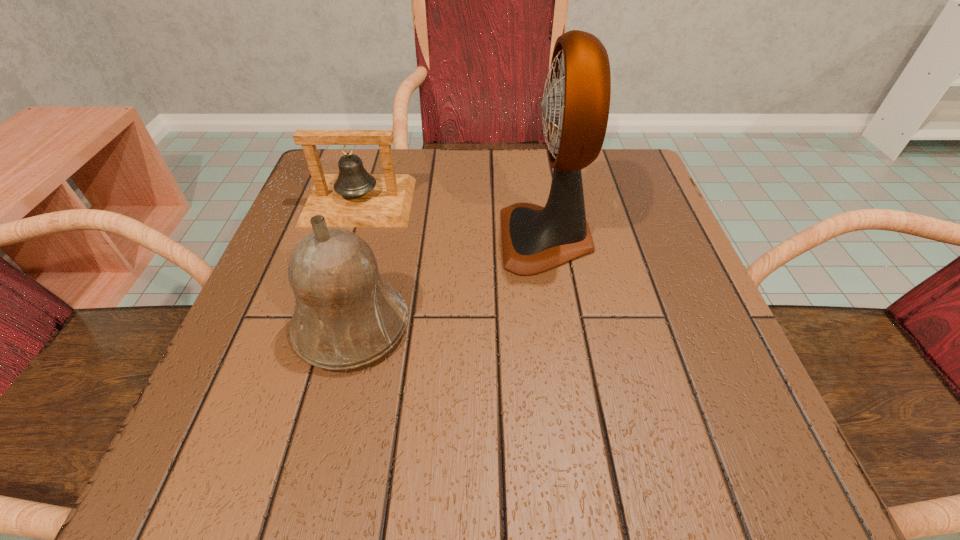
The width and height of the screenshot is (960, 540). I want to click on vacant space located on the right of the farther bell, so click(x=465, y=202).

Locate an element on the screen. This screenshot has width=960, height=540. fan located in the far edge section of the desktop is located at coordinates (575, 107).

At what (x,y) coordinates should I click in order to perform the action: click on bell located in the far edge section of the desktop. Please return your answer as a coordinate pair (x, y). This screenshot has width=960, height=540. Looking at the image, I should click on (353, 198).

Where is `object that is at the right edge`? object that is at the right edge is located at coordinates click(x=575, y=107).

The image size is (960, 540). Find the location of `object located in the far left corner section of the desktop`. object located in the far left corner section of the desktop is located at coordinates click(353, 198).

Find the location of a particular element. This screenshot has height=540, width=960. object that is at the far right corner is located at coordinates (575, 107).

You are a GUI agent. You are given a task and a screenshot of the screen. Output one action in this format:
    pyautogui.click(x=<x>, y=<y>)
    Task: Click on the free location at the far edge
    The image size is (960, 540).
    Given the screenshot: What is the action you would take?
    pyautogui.click(x=417, y=151)

What are the coordinates of `vacant space at the near edge of the desktop` in the screenshot? It's located at (442, 460).

Where is `vacant area at the left edge`? The width and height of the screenshot is (960, 540). vacant area at the left edge is located at coordinates (233, 357).

You are a GUI agent. You are given a task and a screenshot of the screen. Output one action in this format:
    pyautogui.click(x=<x>, y=<y>)
    Task: Click on the blank space at the right edge
    
    Given the screenshot: What is the action you would take?
    pyautogui.click(x=616, y=214)